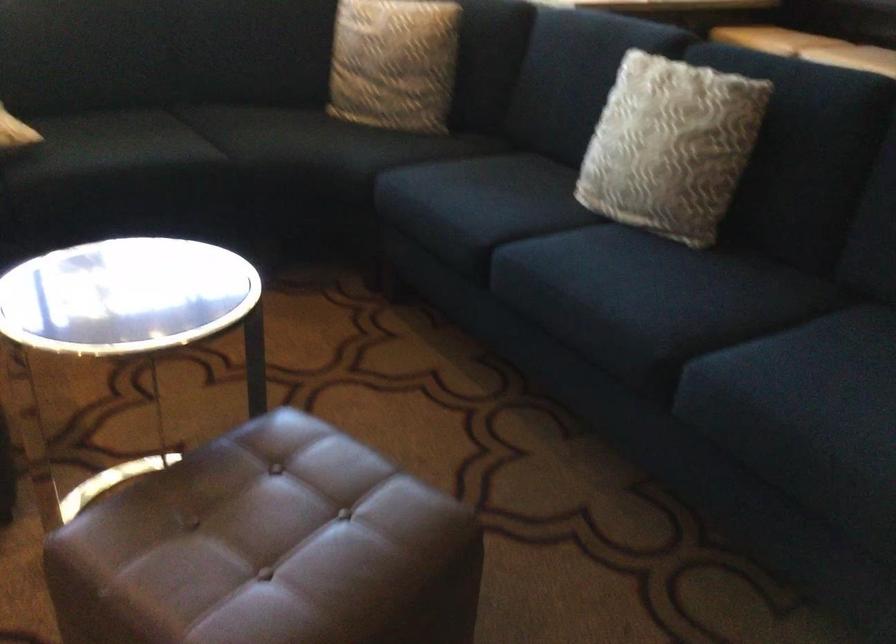
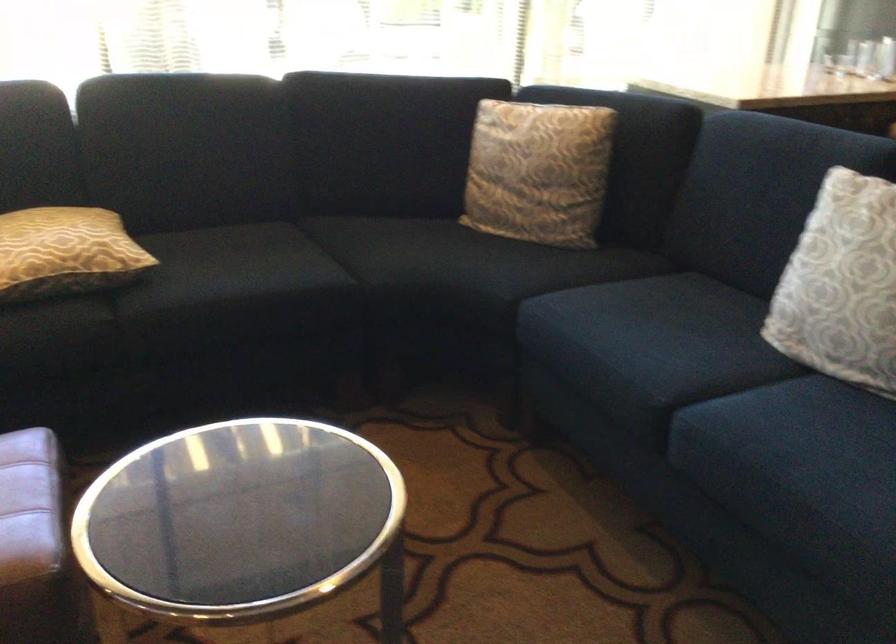
Where in the second image is the point corresponding to point (633, 152) from the first image?

(841, 285)